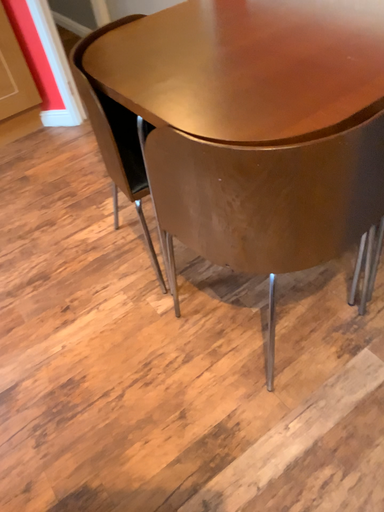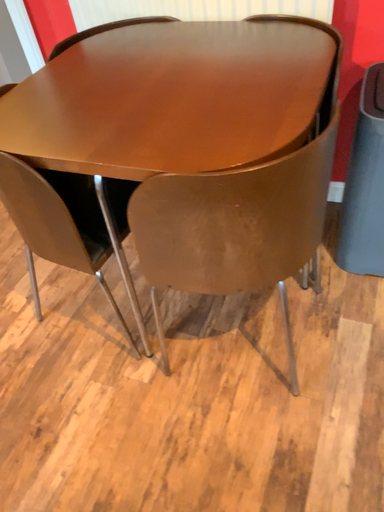
Question: Which way did the camera rotate in the video?

Choices:
 (A) rotated upward
 (B) rotated downward

Answer: (A)